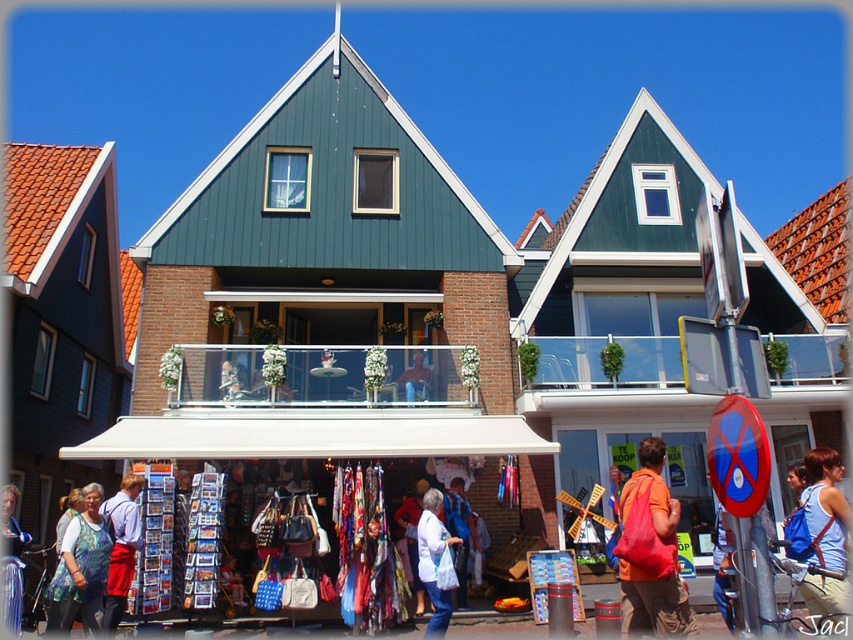
Which is in front, point (630, 492) or point (815, 548)?

Positioned in front is point (630, 492).

The width and height of the screenshot is (853, 640). I want to click on matte orange backpack at center, so click(x=651, y=548).

Between point (113, 561) and point (434, 518), which one is positioned behind?

Point (434, 518)

Is point (131, 529) farther from viewer compared to point (433, 512)?

No, it is in front of (433, 512).

Where is `white cotton shirt at lower left`? white cotton shirt at lower left is located at coordinates (120, 547).

Does matte orange backpack at center have a greater height compared to white fabric bag at center?

Correct, matte orange backpack at center is much taller as white fabric bag at center.

Is point (668, 579) in front of point (427, 490)?

That is True.

Where is `matte orange backpack at center`? matte orange backpack at center is located at coordinates (651, 548).